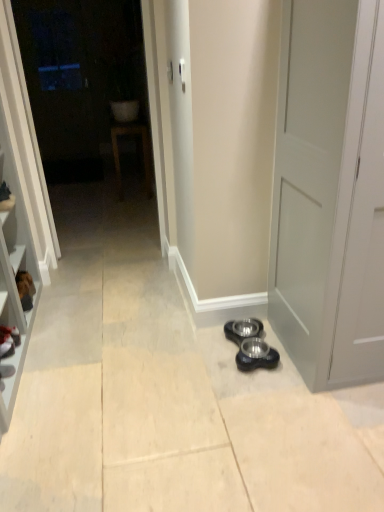
Question: Can you confirm if transparent glass door at upper left is wider than black rubber bowls at lower center?

Choices:
 (A) yes
 (B) no

Answer: (B)

Question: Considering the relative sizes of transparent glass door at upper left and black rubber bowls at lower center in the image provided, is transparent glass door at upper left taller than black rubber bowls at lower center?

Choices:
 (A) no
 (B) yes

Answer: (B)

Question: Are transparent glass door at upper left and black rubber bowls at lower center beside each other?

Choices:
 (A) yes
 (B) no

Answer: (B)

Question: Considering the relative sizes of transparent glass door at upper left and black rubber bowls at lower center in the image provided, is transparent glass door at upper left bigger than black rubber bowls at lower center?

Choices:
 (A) no
 (B) yes

Answer: (B)

Question: Is black rubber bowls at lower center a part of transparent glass door at upper left?

Choices:
 (A) yes
 (B) no

Answer: (B)

Question: From a real-world perspective, is transparent glass door at upper left positioned over black rubber bowls at lower center based on gravity?

Choices:
 (A) no
 (B) yes

Answer: (B)

Question: Is satin silver door handle at upper center turned away from black rubber bowls at lower center?

Choices:
 (A) yes
 (B) no

Answer: (B)

Question: Considering the relative sizes of satin silver door handle at upper center and black rubber bowls at lower center in the image provided, is satin silver door handle at upper center wider than black rubber bowls at lower center?

Choices:
 (A) no
 (B) yes

Answer: (A)

Question: Is satin silver door handle at upper center located outside black rubber bowls at lower center?

Choices:
 (A) yes
 (B) no

Answer: (A)

Question: Can you confirm if satin silver door handle at upper center is bigger than black rubber bowls at lower center?

Choices:
 (A) yes
 (B) no

Answer: (B)

Question: Can you confirm if satin silver door handle at upper center is thinner than black rubber bowls at lower center?

Choices:
 (A) yes
 (B) no

Answer: (A)

Question: Could you tell me if satin silver door handle at upper center is facing black rubber bowls at lower center?

Choices:
 (A) yes
 (B) no

Answer: (B)

Question: Is the surface of satin silver door handle at upper center in direct contact with matte white sink at upper center?

Choices:
 (A) yes
 (B) no

Answer: (B)